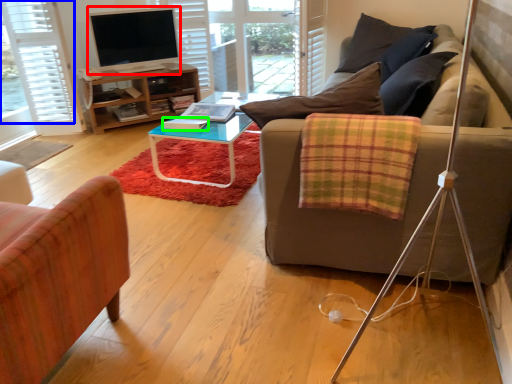
Question: Which is nearer to the television (highlighted by a red box)? curtain (highlighted by a blue box) or book (highlighted by a green box).

Choices:
 (A) curtain
 (B) book

Answer: (A)